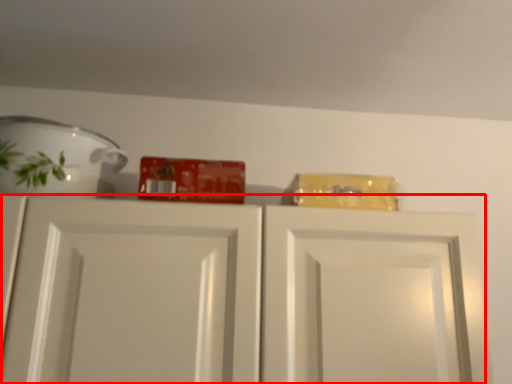
Question: Where is cabinetry (annotated by the red box) located in relation to tableware in the image?

Choices:
 (A) right
 (B) left

Answer: (A)